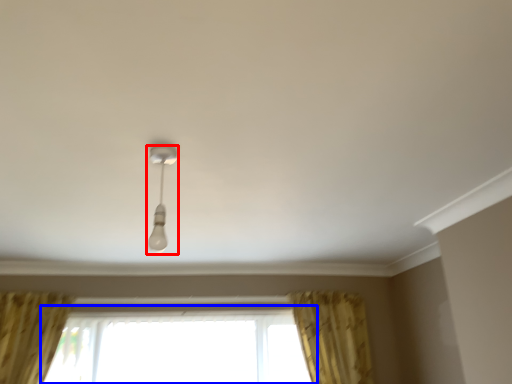
Question: Among these objects, which one is farthest to the camera, lamp (highlighted by a red box) or window (highlighted by a blue box)?

Choices:
 (A) lamp
 (B) window

Answer: (B)